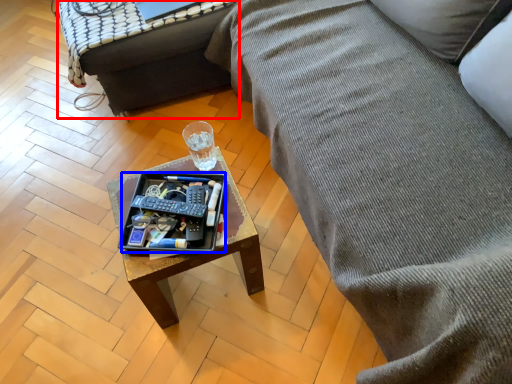
Question: Which of the following is the farthest to the observer, table (highlighted by a red box) or tray (highlighted by a blue box)?

Choices:
 (A) table
 (B) tray

Answer: (A)